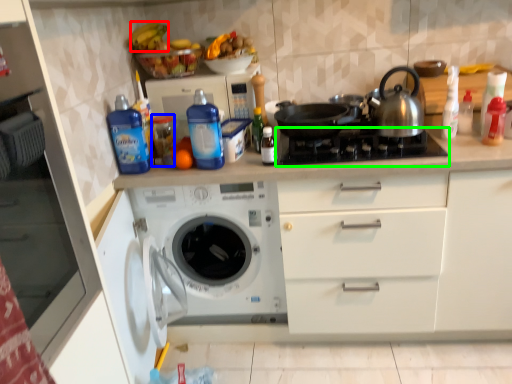
Question: Which is farther away from banana (highlighted by a red box)? bottle (highlighted by a blue box) or gas stove (highlighted by a green box)?

Choices:
 (A) bottle
 (B) gas stove

Answer: (B)